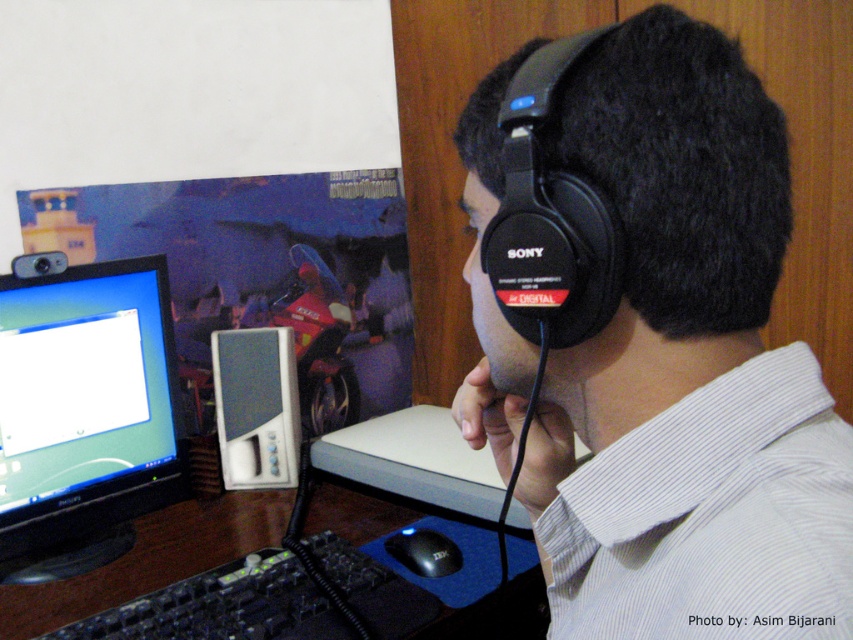
Question: Is matte black monitor at left to the left of black plastic keyboard at lower left from the viewer's perspective?

Choices:
 (A) no
 (B) yes

Answer: (B)

Question: Observing the image, what is the correct spatial positioning of black matte sony headphones at upper right in reference to black plastic keyboard at lower left?

Choices:
 (A) right
 (B) left

Answer: (A)

Question: Which object is the farthest from the black matte headphones at upper right?

Choices:
 (A) black plastic keyboard at lower left
 (B) black matte sony headphones at upper right
 (C) white plastic speaker at center
 (D) matte black monitor at left

Answer: (C)

Question: Which point appears farthest from the camera in this image?

Choices:
 (A) (196, 556)
 (B) (148, 499)

Answer: (B)

Question: Which of the following is the farthest from the observer?

Choices:
 (A) (229, 339)
 (B) (724, 589)

Answer: (A)

Question: Where is matte black monitor at left located in relation to black matte sony headphones at upper right in the image?

Choices:
 (A) right
 (B) left

Answer: (B)